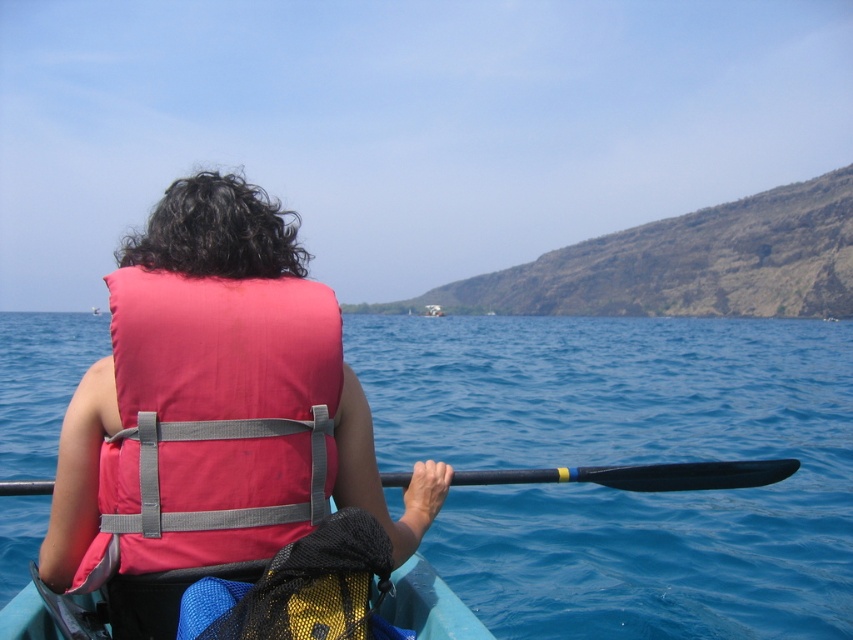
Question: Can you confirm if blue water at center is positioned below pink fabric life jacket at center?

Choices:
 (A) no
 (B) yes

Answer: (A)

Question: Which object is the closest to the pink fabric life vest at center?

Choices:
 (A) black rubber paddle at center
 (B) pink fabric life jacket at center
 (C) blue water at center

Answer: (B)

Question: Is pink fabric life vest at center further to camera compared to pink fabric life jacket at center?

Choices:
 (A) yes
 (B) no

Answer: (B)

Question: Is blue water at center smaller than black rubber paddle at center?

Choices:
 (A) yes
 (B) no

Answer: (B)

Question: Which point appears farthest from the camera in this image?

Choices:
 (A) (173, 508)
 (B) (404, 538)
 (C) (669, 465)
 (D) (552, 346)

Answer: (D)

Question: Among these objects, which one is farthest from the camera?

Choices:
 (A) pink fabric life jacket at center
 (B) black rubber paddle at center
 (C) pink fabric life vest at center
 (D) blue water at center

Answer: (D)